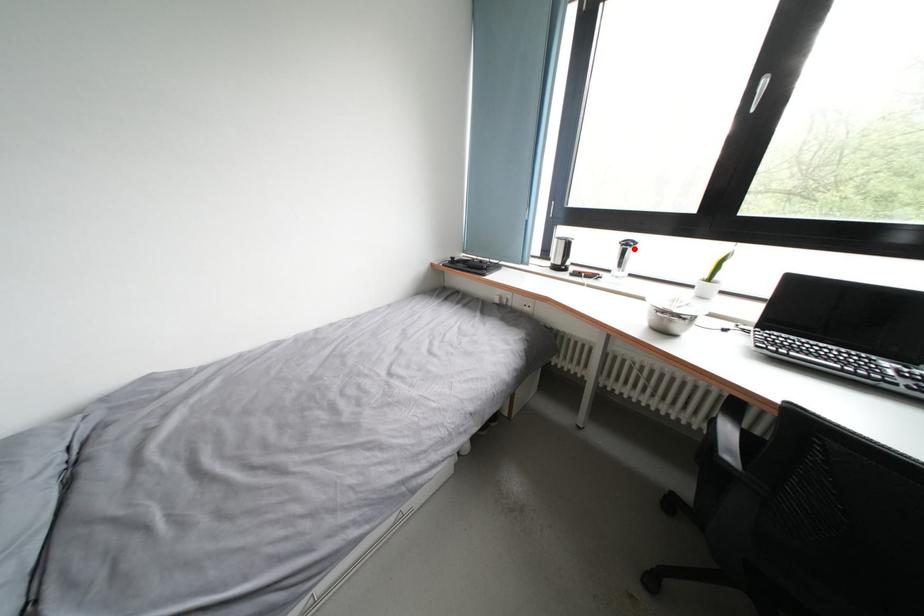
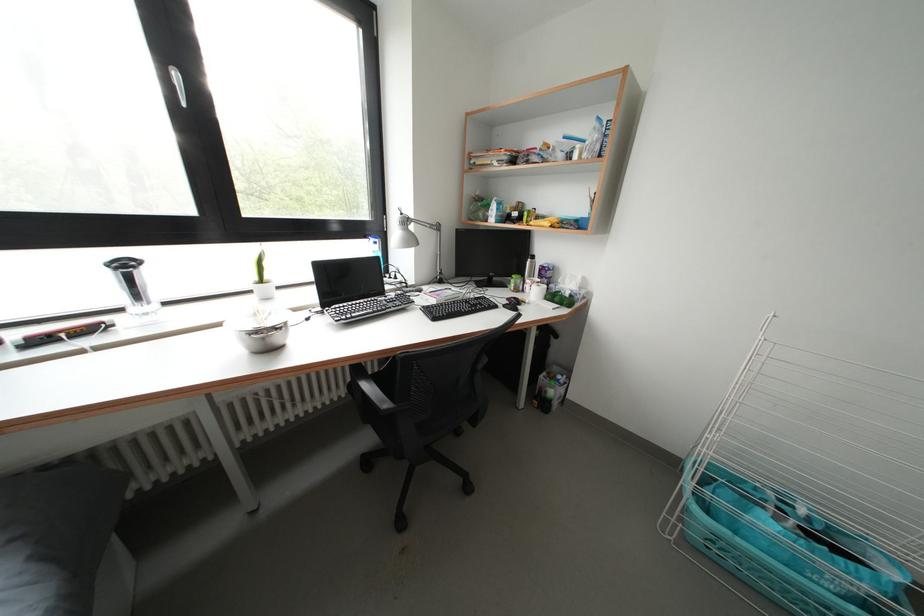
Where in the second image is the point corresponding to the highlighted location from the first image?

(131, 270)